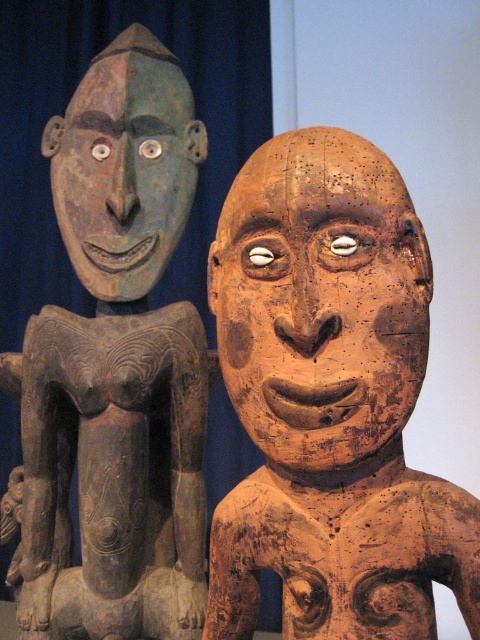
Question: Which of the following is the farthest from the observer?

Choices:
 (A) (129, 134)
 (B) (291, 413)
 (C) (96, 612)

Answer: (A)

Question: Does matte gray wood figure at left appear over matte green wood mask at upper left?

Choices:
 (A) yes
 (B) no

Answer: (B)

Question: Is brown wooden mask at center in front of matte green wood mask at upper left?

Choices:
 (A) no
 (B) yes

Answer: (B)

Question: Which object is the closest to the matte green wood mask at upper left?

Choices:
 (A) brown wooden mask at center
 (B) matte gray wood figure at left

Answer: (B)

Question: Which of the following is the farthest from the observer?

Choices:
 (A) (137, 237)
 (B) (405, 404)

Answer: (A)

Question: Is the position of matte gray wood figure at left more distant than that of matte green wood mask at upper left?

Choices:
 (A) yes
 (B) no

Answer: (B)